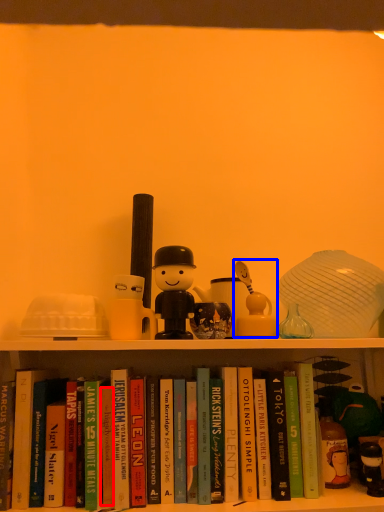
Question: Which object is further to the camera taking this photo, paperback book (highlighted by a red box) or figurine (highlighted by a blue box)?

Choices:
 (A) paperback book
 (B) figurine

Answer: (B)